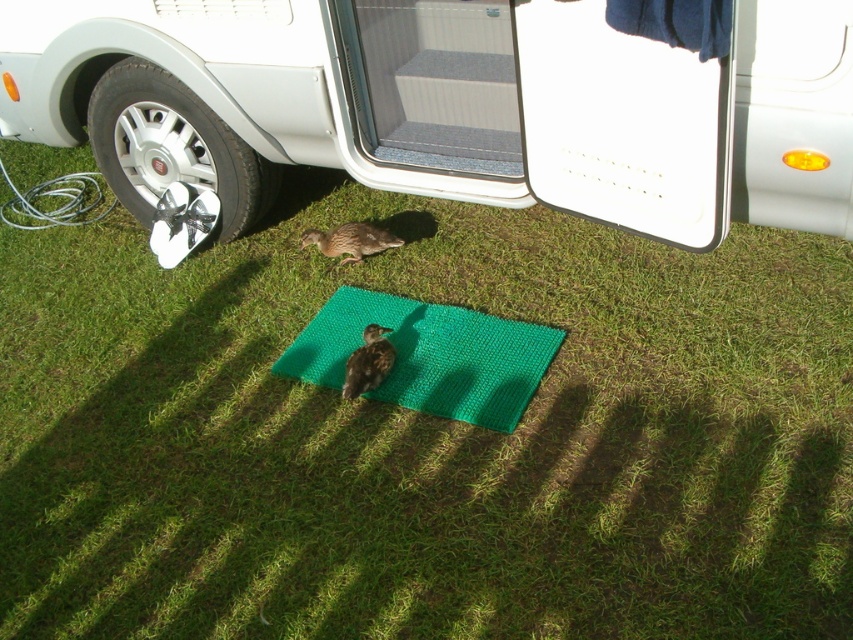
Find the location of a particular element. This screenshot has height=640, width=853. clear plastic screen door at upper center is located at coordinates (428, 97).

You are a GUI agent. You are given a task and a screenshot of the screen. Output one action in this format:
    pyautogui.click(x=<x>, y=<y>)
    Task: Click on the clear plastic screen door at upper center
    The image size is (853, 640).
    Given the screenshot: What is the action you would take?
    pyautogui.click(x=428, y=97)

Can you confirm if brown feathered duck at center is positioned below brown fuzzy bird at center?

Actually, brown feathered duck at center is above brown fuzzy bird at center.

Does brown feathered duck at center have a larger size compared to brown fuzzy bird at center?

Actually, brown feathered duck at center might be smaller than brown fuzzy bird at center.

Identify the location of brown feathered duck at center. (350, 241).

You are a GUI agent. You are given a task and a screenshot of the screen. Output one action in this format:
    pyautogui.click(x=<x>, y=<y>)
    Task: Click on the brown feathered duck at center
    The image size is (853, 640).
    Given the screenshot: What is the action you would take?
    pyautogui.click(x=350, y=241)

Which is in front, point (457, 90) or point (341, 248)?

Positioned in front is point (457, 90).

Can you confirm if clear plastic screen door at upper center is taller than brown feathered duck at center?

Indeed, clear plastic screen door at upper center has a greater height compared to brown feathered duck at center.

Is point (387, 177) closer to viewer compared to point (315, 230)?

Yes, it is.

You are a GUI agent. You are given a task and a screenshot of the screen. Output one action in this format:
    pyautogui.click(x=<x>, y=<y>)
    Task: Click on the clear plastic screen door at upper center
    The height and width of the screenshot is (640, 853).
    Given the screenshot: What is the action you would take?
    pyautogui.click(x=428, y=97)